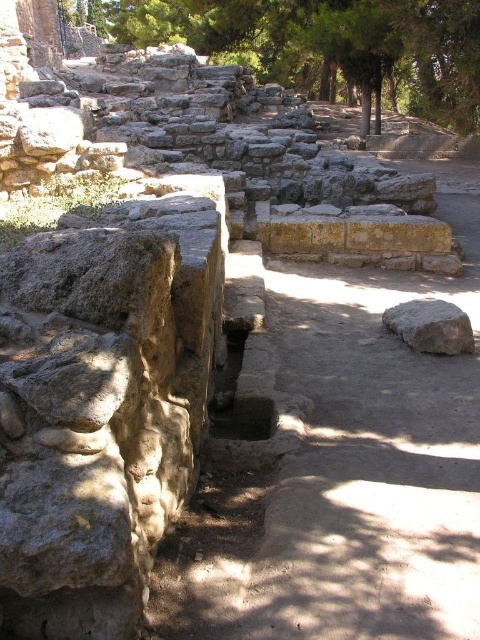
Question: Is green leafy tree at upper center wider than smooth beige rock at center right?

Choices:
 (A) no
 (B) yes

Answer: (B)

Question: Among these points, which one is farthest from the camera?

Choices:
 (A) (431, 324)
 (B) (332, 81)

Answer: (B)

Question: Among these objects, which one is farthest from the camera?

Choices:
 (A) green leafy tree at upper center
 (B) smooth beige rock at center right

Answer: (A)

Question: Is green leafy tree at upper center smaller than smooth beige rock at center right?

Choices:
 (A) no
 (B) yes

Answer: (A)

Question: Does green leafy tree at upper center have a smaller size compared to smooth beige rock at center right?

Choices:
 (A) yes
 (B) no

Answer: (B)